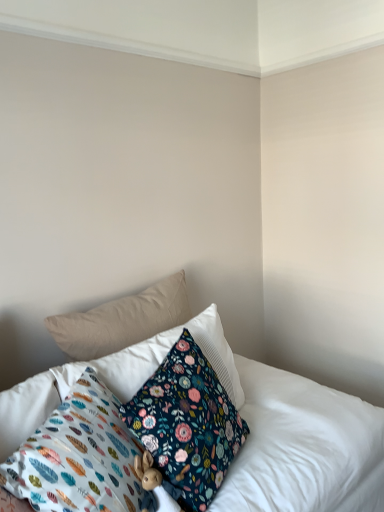
Question: Is floral fabric pillow at center, marked as the 2th pillow in a back-to-front arrangement, looking in the opposite direction of floral fabric pillow at lower center, which is the 4th pillow in back-to-front order?

Choices:
 (A) no
 (B) yes

Answer: (A)

Question: Does floral fabric pillow at center, marked as the 2th pillow in a back-to-front arrangement, appear on the right side of floral fabric pillow at lower center, which is the 4th pillow in back-to-front order?

Choices:
 (A) no
 (B) yes

Answer: (B)

Question: From a real-world perspective, is floral fabric pillow at center, marked as the 2th pillow in a back-to-front arrangement, located beneath floral fabric pillow at lower center, which is the 1th pillow from front to back?

Choices:
 (A) no
 (B) yes

Answer: (A)

Question: Considering the relative sizes of floral fabric pillow at center, acting as the 3th pillow starting from the front, and floral fabric pillow at lower center, which is the 1th pillow from front to back, in the image provided, is floral fabric pillow at center, acting as the 3th pillow starting from the front, bigger than floral fabric pillow at lower center, which is the 1th pillow from front to back,?

Choices:
 (A) yes
 (B) no

Answer: (A)

Question: Is floral fabric pillow at center, acting as the 3th pillow starting from the front, located outside floral fabric pillow at lower center, which is the 1th pillow from front to back?

Choices:
 (A) no
 (B) yes

Answer: (B)

Question: Is the surface of floral fabric pillow at center, marked as the 2th pillow in a back-to-front arrangement, in direct contact with floral fabric pillow at lower center, which is the 1th pillow from front to back?

Choices:
 (A) no
 (B) yes

Answer: (A)

Question: From a real-world perspective, does floral fabric pillow at center, acting as the 3th pillow starting from the front, stand above beige fabric pillow at upper left, the first pillow when ordered from back to front?

Choices:
 (A) no
 (B) yes

Answer: (A)

Question: Does floral fabric pillow at center, marked as the 2th pillow in a back-to-front arrangement, come behind beige fabric pillow at upper left, the first pillow when ordered from back to front?

Choices:
 (A) no
 (B) yes

Answer: (A)

Question: From a real-world perspective, does floral fabric pillow at center, acting as the 3th pillow starting from the front, sit lower than beige fabric pillow at upper left, the first pillow when ordered from back to front?

Choices:
 (A) no
 (B) yes

Answer: (B)

Question: Can you confirm if floral fabric pillow at center, acting as the 3th pillow starting from the front, is smaller than beige fabric pillow at upper left, the first pillow when ordered from back to front?

Choices:
 (A) yes
 (B) no

Answer: (B)

Question: Are floral fabric pillow at center, marked as the 2th pillow in a back-to-front arrangement, and beige fabric pillow at upper left, positioned as the 4th pillow in front-to-back order, making contact?

Choices:
 (A) no
 (B) yes

Answer: (A)

Question: Is floral fabric pillow at center, marked as the 2th pillow in a back-to-front arrangement, looking in the opposite direction of beige fabric pillow at upper left, positioned as the 4th pillow in front-to-back order?

Choices:
 (A) yes
 (B) no

Answer: (A)

Question: Considering the relative sizes of floral fabric pillow at center, acting as the 3th pillow starting from the back, and beige fabric pillow at upper left, the first pillow when ordered from back to front, in the image provided, is floral fabric pillow at center, acting as the 3th pillow starting from the back, taller than beige fabric pillow at upper left, the first pillow when ordered from back to front,?

Choices:
 (A) yes
 (B) no

Answer: (A)